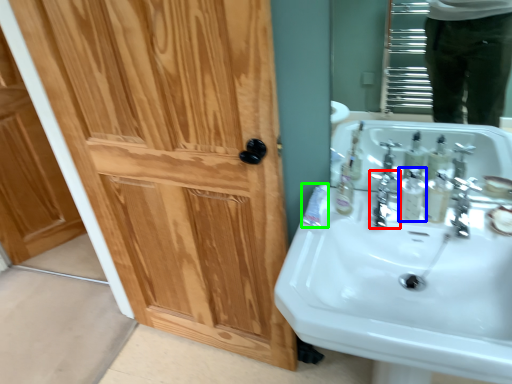
Question: Which object is positioned closest to plumbing fixture (highlighted by a red box)? Select from mouthwash (highlighted by a blue box) and toothpaste (highlighted by a green box).

Choices:
 (A) mouthwash
 (B) toothpaste

Answer: (A)